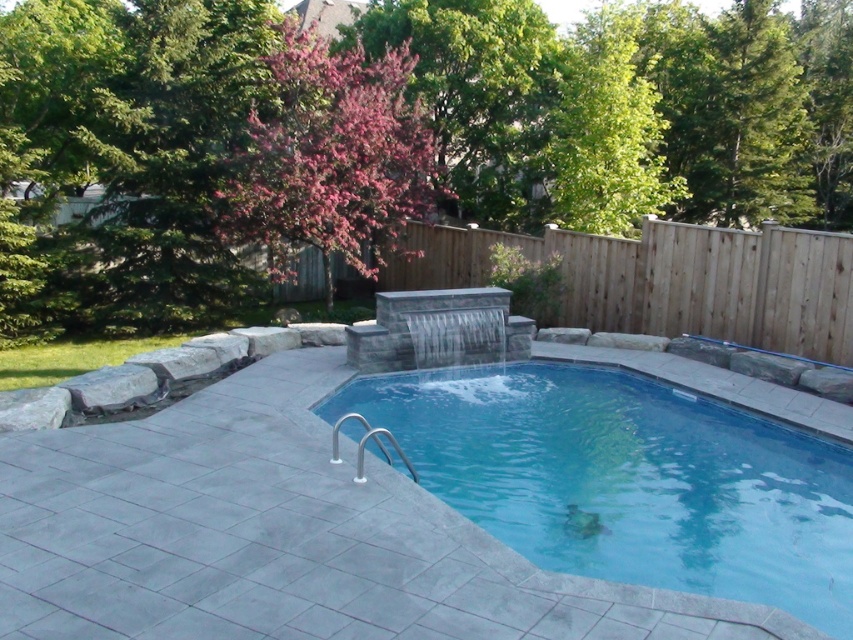
You are standing on the pool deck and want to take a photo of the blue smooth pool at center with the pink flowering tree at upper center in the background. Which direction should you face to ensure both are in the frame?

You should face to the right of the blue smooth pool at center to include the pink flowering tree at upper center in the background since the pink flowering tree at upper center is located to the right of the blue smooth pool at center.

You are standing in the backyard and want to take a photo of the blue smooth pool at center. If your camera has a maximum focus range of 10 feet, will you need to move closer to take a clear picture?

The blue smooth pool at center is 11.60 feet away from the viewer, which exceeds the camera maximum focus range of 10 feet. Therefore, you need to move closer to ensure a clear photo.